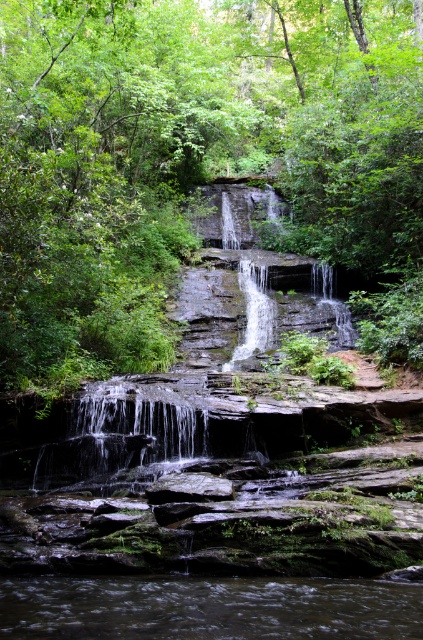
Who is more forward, (79, 112) or (198, 481)?

Positioned in front is point (198, 481).

Which is more to the right, green leafy tree at center or gray rough rock at center?

green leafy tree at center is more to the right.

In the scene shown: Who is more distant from viewer, (5,45) or (195,483)?

Point (5,45)

I want to click on green leafy tree at center, so click(198, 164).

Which is behind, point (87, 614) or point (195, 474)?

Positioned behind is point (195, 474).

Does brown/muddy water at lower center appear under gray rough rock at center?

Indeed, brown/muddy water at lower center is positioned under gray rough rock at center.

Which is behind, point (275, 636) or point (186, 496)?

Positioned behind is point (186, 496).

The image size is (423, 640). In order to click on brown/muddy water at lower center in this screenshot , I will do `click(208, 609)`.

Which is more to the left, green leafy tree at center or smooth gray rock waterfall at center?

Positioned to the left is green leafy tree at center.

Who is more forward, [151,196] or [250,330]?

Point [250,330] is more forward.

Who is more forward, (2, 205) or (263, 332)?

Positioned in front is point (2, 205).

Find the location of `green leafy tree at center`. green leafy tree at center is located at coordinates (198, 164).